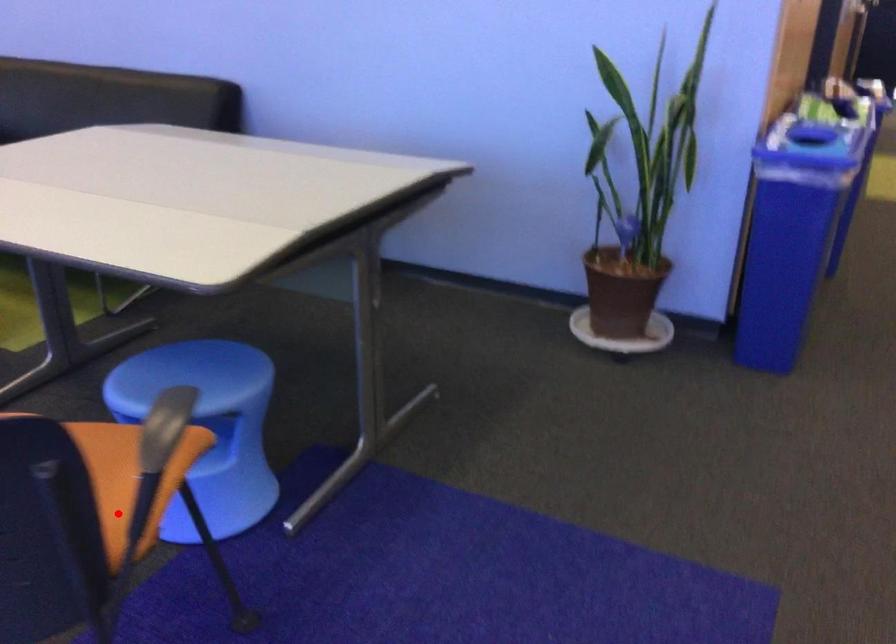
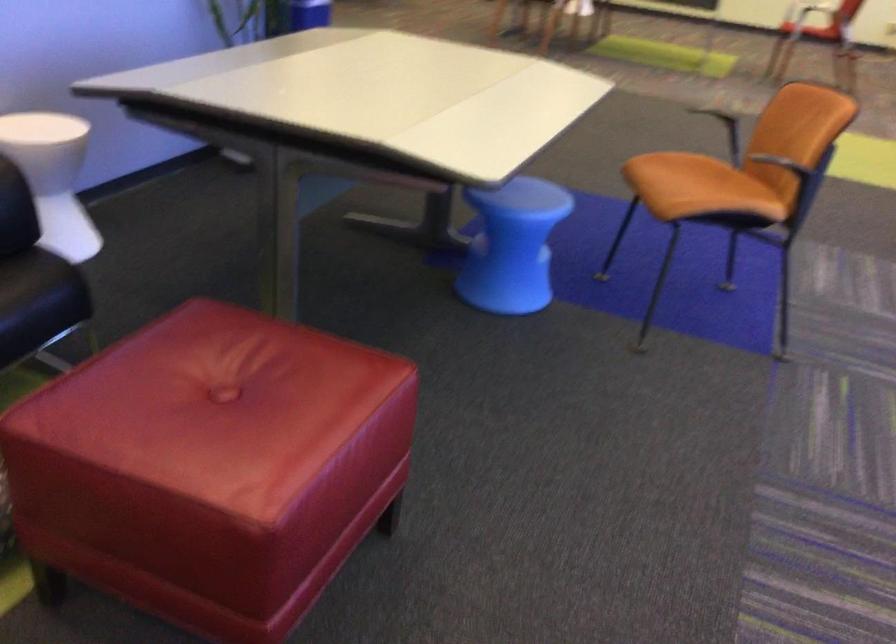
Question: A red point is marked in image1. In image2, is the corresponding 3D point closer to the camera or farther? Reply with the corresponding letter.

Choices:
 (A) The corresponding 3D point is closer.
 (B) The corresponding 3D point is farther.

Answer: (B)